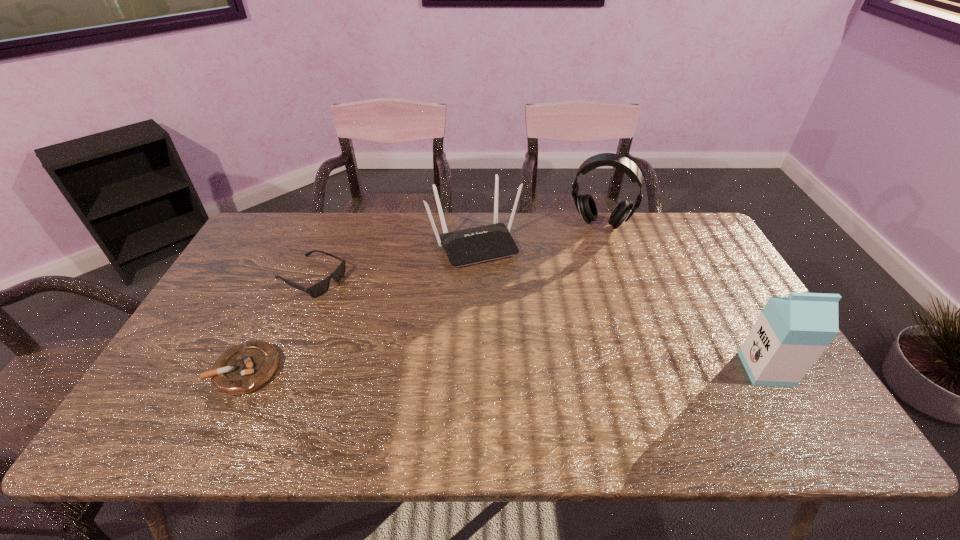
This screenshot has width=960, height=540. Find the location of `vacant space on the desktop that is between the shortest object and the rightmost object and is positioned on the front-facing side of the third object from left to right`. vacant space on the desktop that is between the shortest object and the rightmost object and is positioned on the front-facing side of the third object from left to right is located at coordinates (540, 369).

I want to click on free space on the desktop that is between the shortest object and the rightmost object and is positioned on the ear cups of the earphone, so click(x=560, y=369).

The width and height of the screenshot is (960, 540). In order to click on vacant space on the desktop that is between the ashtray and the milk carton and is positioned on the front-facing side of the sunglasses in this screenshot , I will do `click(506, 369)`.